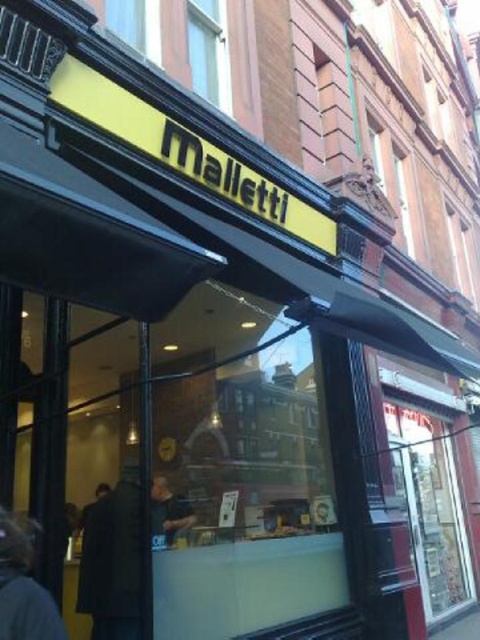
Looking at this image, you are standing in front of the Malletti shop and notice a point marked at coordinates (112, 561). Based on the scene description, what object is this point located on?

The point at coordinates (112, 561) is located on the dark brown coat at center.

You are a customer entering the Malletti shop and see the dark brown coat at center and the dark brown leather jacket at lower left. Which one is taller?

The dark brown coat at center is taller than the dark brown leather jacket at lower left.

You are a customer entering the Malletti shop and see the dark brown coat at center and the dark brown leather jacket at lower left. Which item is closer to the entrance?

The dark brown coat at center is below the dark brown leather jacket at lower left, so the dark brown leather jacket at lower left is closer to the entrance since it is positioned higher up.